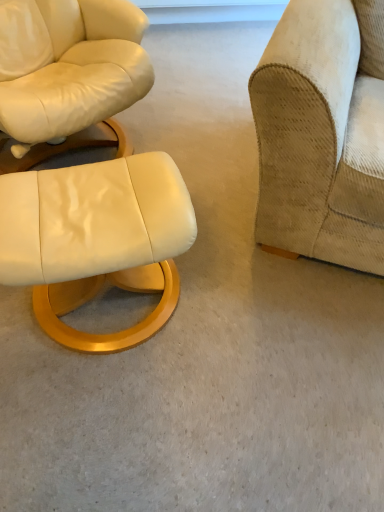
Find the location of a particular element. vacant area situated below matte white leather ottoman at lower left (from a real-world perspective) is located at coordinates (120, 309).